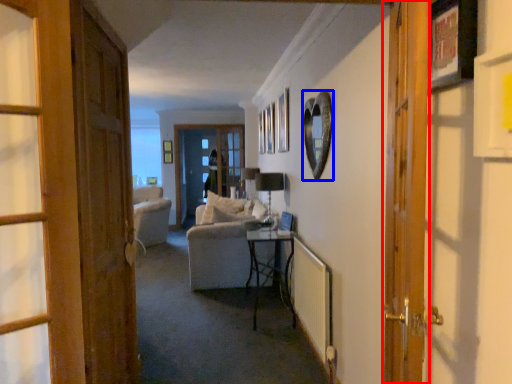
Question: Which point is further to the camera, door (highlighted by a red box) or picture frame (highlighted by a blue box)?

Choices:
 (A) door
 (B) picture frame

Answer: (B)